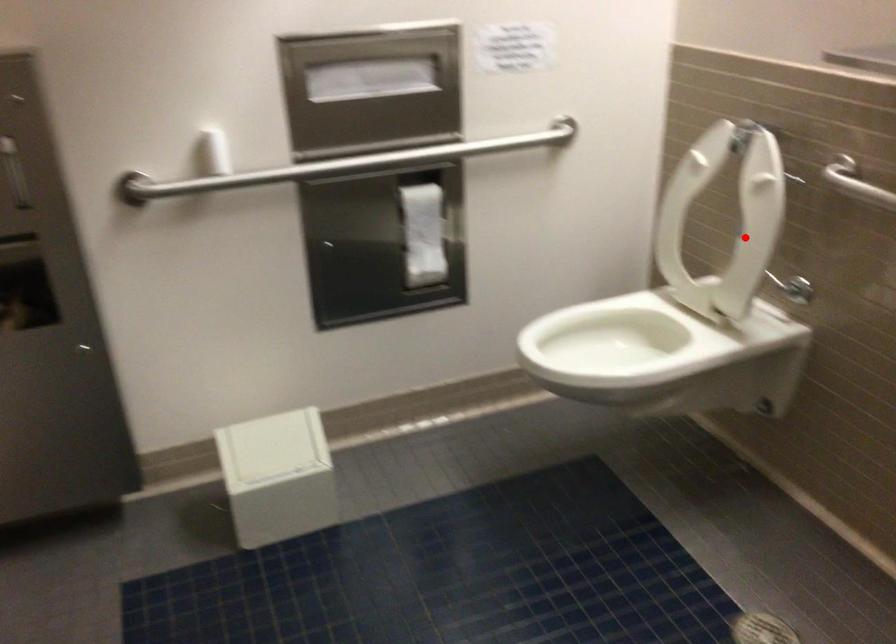
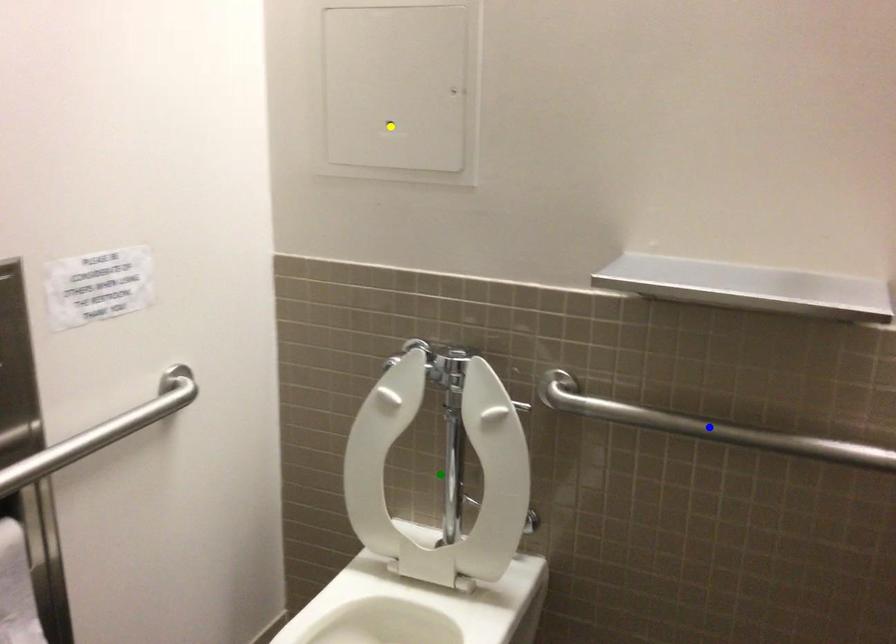
Question: I am providing you with two images of the same scene from different viewpoints. A red point is marked on the first image. You are given multiple points on the second image. In image 2, which mark is for the same physical point as the one in image 1?

Choices:
 (A) blue point
 (B) yellow point
 (C) green point

Answer: (C)